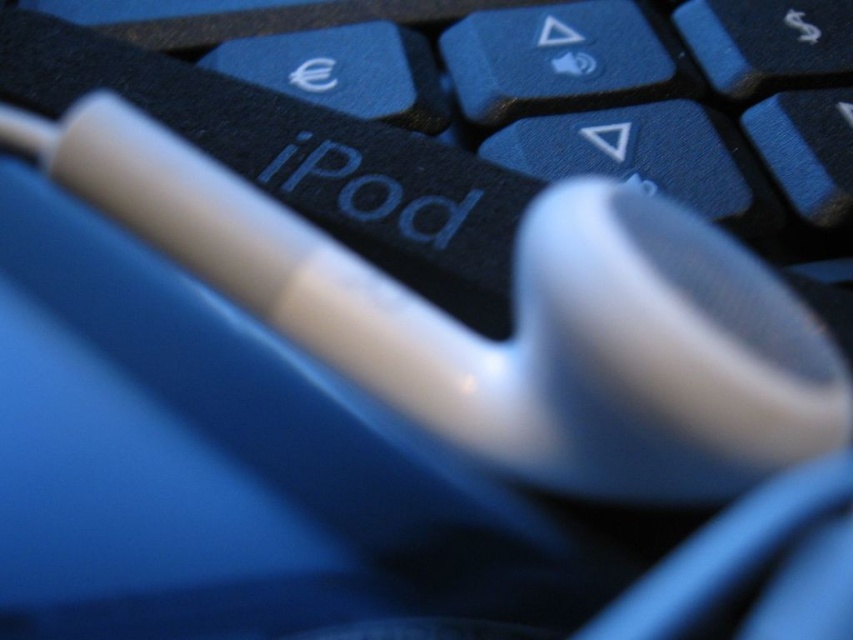
Question: In this image, where is white plastic mouse at center located relative to black matte keyboard at center?

Choices:
 (A) above
 (B) below

Answer: (B)

Question: Can you confirm if white plastic mouse at center is positioned above black matte keyboard at center?

Choices:
 (A) no
 (B) yes

Answer: (A)

Question: Which point appears closest to the camera in this image?

Choices:
 (A) (592, 337)
 (B) (395, 131)

Answer: (A)

Question: Does white plastic mouse at center have a greater width compared to black matte keyboard at center?

Choices:
 (A) no
 (B) yes

Answer: (A)

Question: Among these objects, which one is nearest to the camera?

Choices:
 (A) black matte keyboard at center
 (B) white plastic mouse at center

Answer: (B)